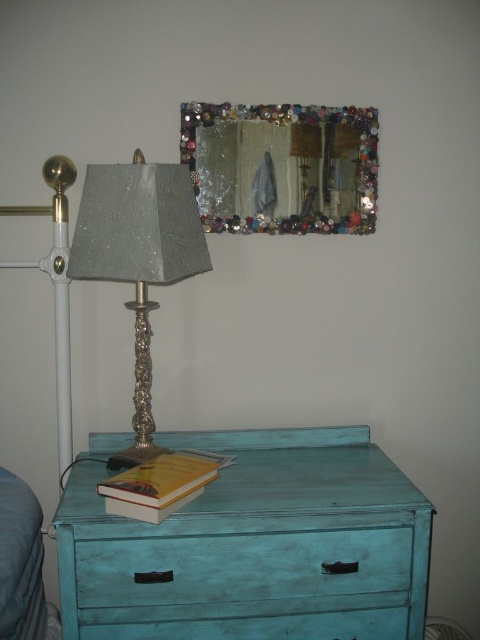
Consider the image. You are arranging a shelf and need to know the vertical distance between the decorative glass mirror at upper center and the teal painted wood drawer at center. Can you determine if the mirror is placed above the drawer?

The decorative glass mirror at upper center is located above the teal painted wood drawer at center, so yes, the mirror is placed above the drawer.

You are trying to place a small vase on the turquoise distressed wood table at lower center. However, there is already a yellow paperback book at lower center on it. Can you fit the vase next to the book without moving it?

The turquoise distressed wood table at lower center is further to the viewer than the yellow paperback book at lower center, so there might still be space next to the book to place the vase without moving it.

You are trying to place a new decorative item on the turquoise distressed wood table at lower center. Considering the size of the yellow paperback book at lower center, will there be enough space for both items?

The turquoise distressed wood table at lower center is bigger than the yellow paperback book at lower center, so there should be enough space for both items.